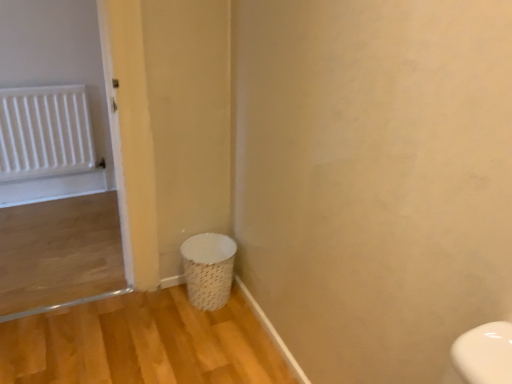
Question: Is white woven laundry basket at lower left inside or outside of white plastic radiator at upper left?

Choices:
 (A) inside
 (B) outside

Answer: (B)

Question: From the image's perspective, is white woven laundry basket at lower left positioned above or below white plastic radiator at upper left?

Choices:
 (A) below
 (B) above

Answer: (A)

Question: Relative to white plastic radiator at upper left, is white woven laundry basket at lower left in front or behind?

Choices:
 (A) behind
 (B) front

Answer: (B)

Question: Is white plastic radiator at upper left wider or thinner than white woven laundry basket at lower left?

Choices:
 (A) wide
 (B) thin

Answer: (B)

Question: From a real-world perspective, is white plastic radiator at upper left physically located above or below white woven laundry basket at lower left?

Choices:
 (A) above
 (B) below

Answer: (A)

Question: In the image, is white plastic radiator at upper left on the left side or the right side of white woven laundry basket at lower left?

Choices:
 (A) left
 (B) right

Answer: (A)

Question: In terms of size, does white plastic radiator at upper left appear bigger or smaller than white woven laundry basket at lower left?

Choices:
 (A) small
 (B) big

Answer: (A)